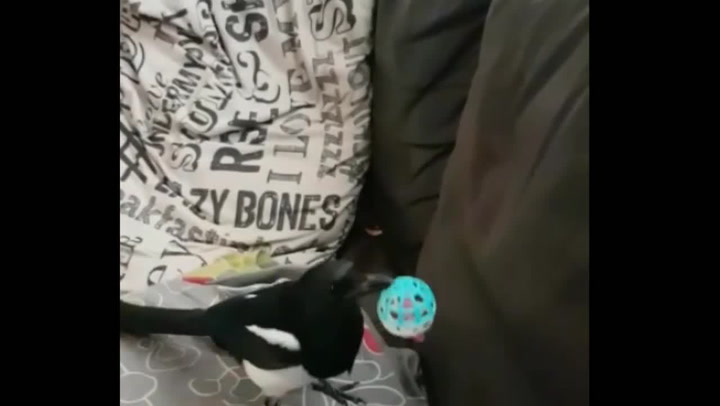
Locate an element on the screen. "i love" text on blanket is located at coordinates (301, 132).